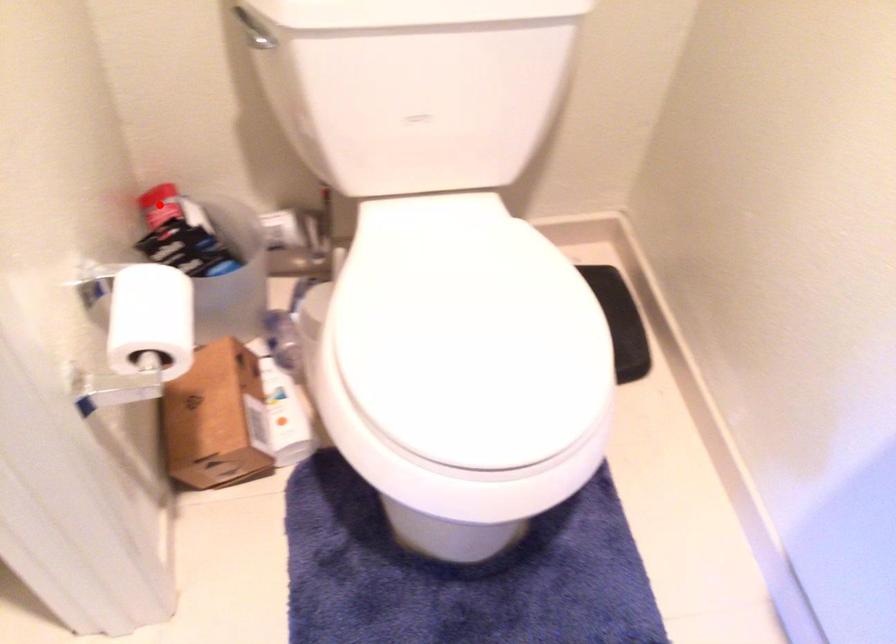
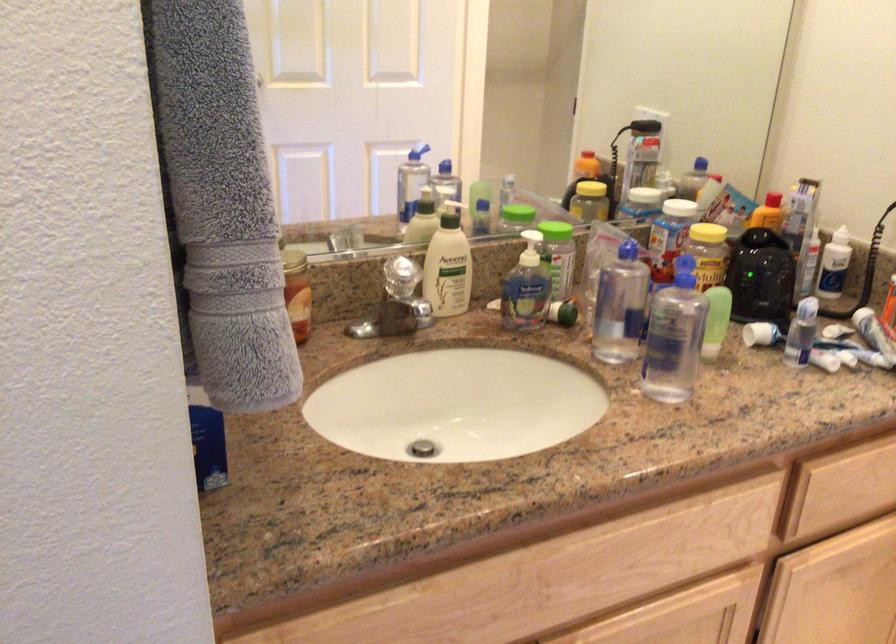
Question: I am providing you with two images of the same scene from different viewpoints. A red point is marked on the first image. Is the red point's position out of view in image 2?

Choices:
 (A) Yes
 (B) No

Answer: (A)